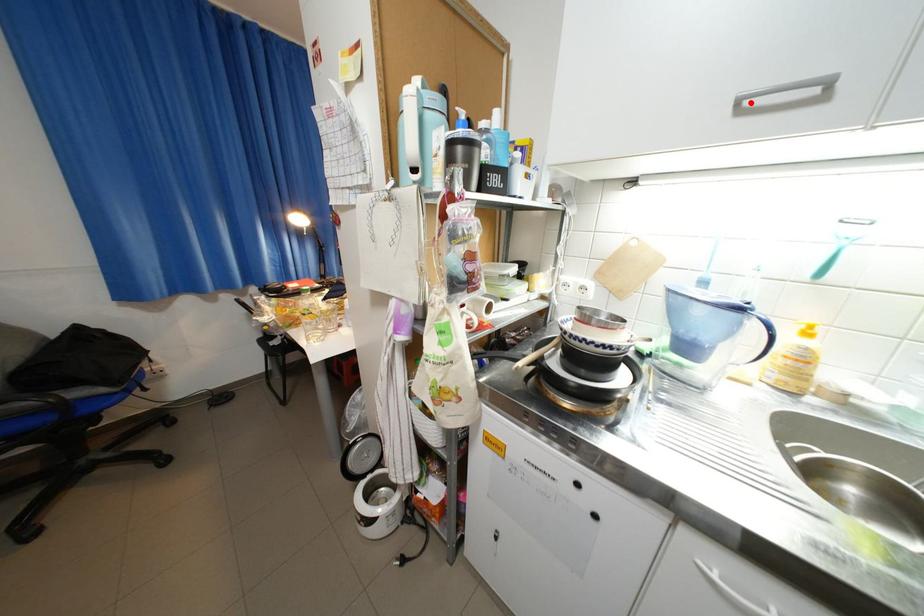
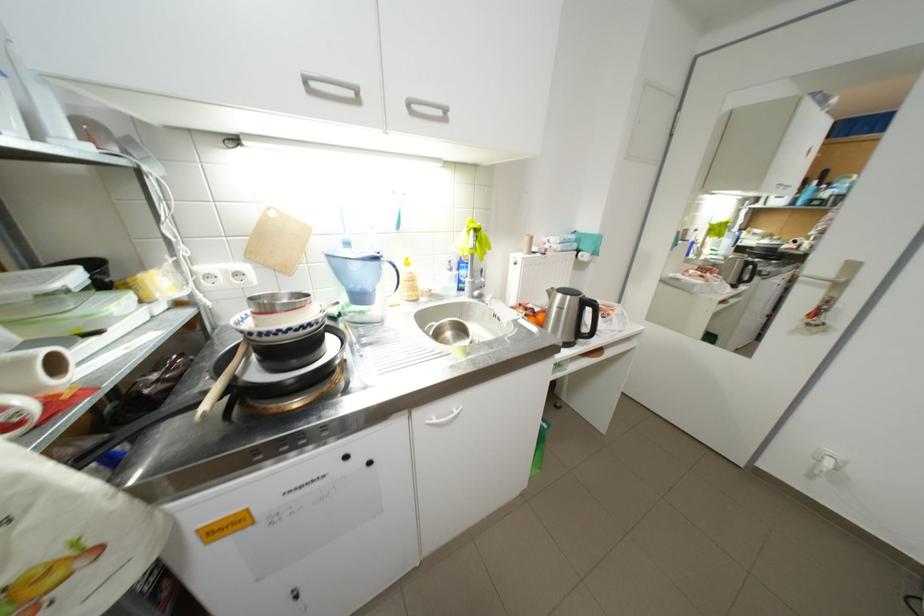
Find the pixel in the second image that matches the highlighted location in the first image.

(317, 79)